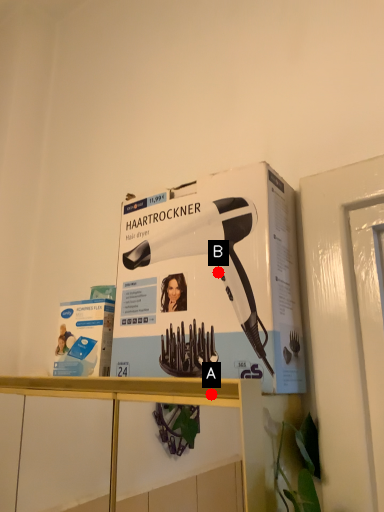
Question: Two points are circled on the image, labeled by A and B beside each circle. Among these points, which one is farthest from the camera?

Choices:
 (A) A is further
 (B) B is further

Answer: (B)